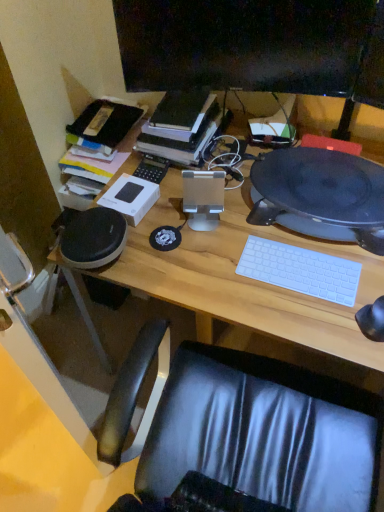
Locate an element on the screen. This screenshot has height=512, width=384. vacant space to the right of white matte keyboard at center is located at coordinates (353, 263).